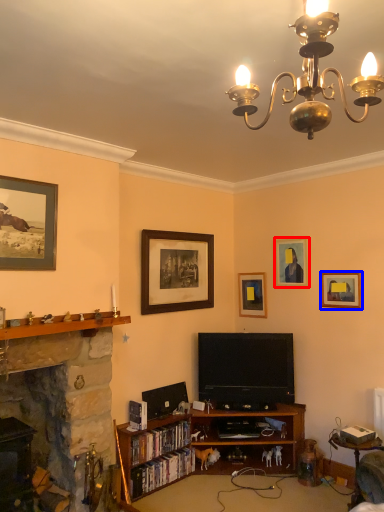
Question: Which of the following is the farthest to the observer, picture frame (highlighted by a red box) or picture frame (highlighted by a blue box)?

Choices:
 (A) picture frame
 (B) picture frame

Answer: (A)